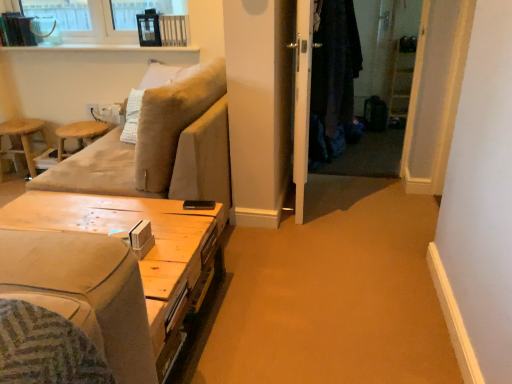
Question: Would you consider woodenmaterial/texturetable at lower left to be distant from dark woolen robe at center?

Choices:
 (A) no
 (B) yes

Answer: (B)

Question: From a real-world perspective, is woodenmaterial/texturetable at lower left beneath dark woolen robe at center?

Choices:
 (A) yes
 (B) no

Answer: (A)

Question: Are woodenmaterial/texturetable at lower left and dark woolen robe at center making contact?

Choices:
 (A) yes
 (B) no

Answer: (B)

Question: Can you confirm if woodenmaterial/texturetable at lower left is taller than dark woolen robe at center?

Choices:
 (A) yes
 (B) no

Answer: (B)

Question: Does woodenmaterial/texturetable at lower left have a lesser height compared to dark woolen robe at center?

Choices:
 (A) yes
 (B) no

Answer: (A)

Question: From the image's perspective, would you say woodenmaterial/texturetable at lower left is positioned over dark woolen robe at center?

Choices:
 (A) yes
 (B) no

Answer: (B)

Question: From the image's perspective, is white glossy screen door at center located beneath wooden stool at left, acting as the second bar stool starting from the right?

Choices:
 (A) no
 (B) yes

Answer: (A)

Question: Considering the relative sizes of white glossy screen door at center and wooden stool at left, arranged as the 1th bar stool when viewed from the left, in the image provided, is white glossy screen door at center shorter than wooden stool at left, arranged as the 1th bar stool when viewed from the left,?

Choices:
 (A) no
 (B) yes

Answer: (A)

Question: Does white glossy screen door at center appear on the right side of wooden stool at left, acting as the second bar stool starting from the right?

Choices:
 (A) no
 (B) yes

Answer: (B)

Question: Can wooden stool at left, arranged as the 1th bar stool when viewed from the left, be found inside white glossy screen door at center?

Choices:
 (A) no
 (B) yes

Answer: (A)

Question: Can you confirm if white glossy screen door at center is smaller than wooden stool at left, arranged as the 1th bar stool when viewed from the left?

Choices:
 (A) yes
 (B) no

Answer: (B)

Question: From a real-world perspective, is white glossy screen door at center below wooden stool at left, acting as the second bar stool starting from the right?

Choices:
 (A) no
 (B) yes

Answer: (A)

Question: From a real-world perspective, does wooden stool at left, acting as the second bar stool starting from the right, stand above white glossy screen door at center?

Choices:
 (A) no
 (B) yes

Answer: (A)